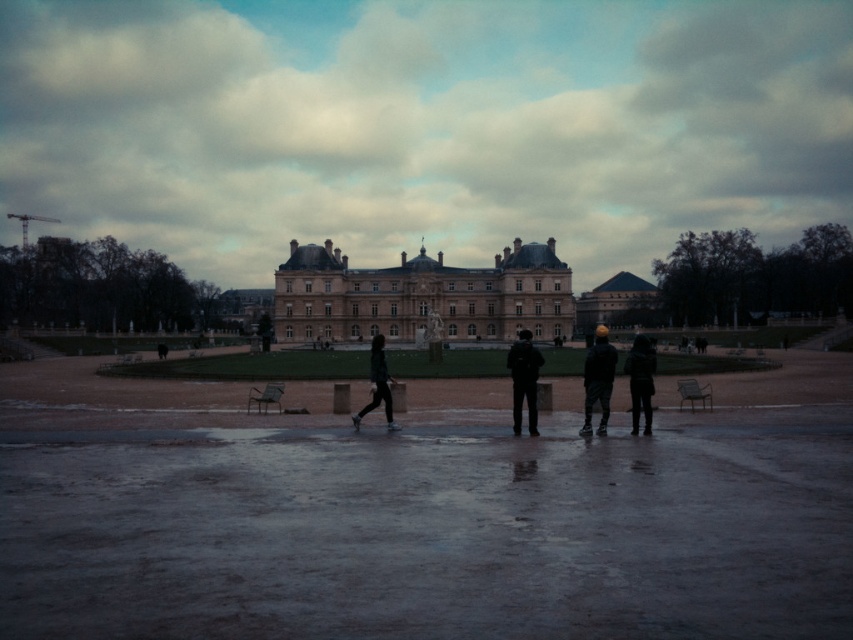
Locate an element on the screen. The height and width of the screenshot is (640, 853). beige stone palace at center is located at coordinates (422, 296).

Can you confirm if beige stone palace at center is smaller than dark blue jacket at center?

No, beige stone palace at center is not smaller than dark blue jacket at center.

Is point (325, 304) closer to camera compared to point (590, 412)?

That is False.

Where is `beige stone palace at center`? beige stone palace at center is located at coordinates (422, 296).

The height and width of the screenshot is (640, 853). What do you see at coordinates (422, 296) in the screenshot?
I see `beige stone palace at center` at bounding box center [422, 296].

Is point (402, 259) positioned in front of point (527, 416)?

That is False.

At what (x,y) coordinates should I click in order to perform the action: click on beige stone palace at center. Please return your answer as a coordinate pair (x, y). The width and height of the screenshot is (853, 640). Looking at the image, I should click on (422, 296).

Between dark blue fabric jacket at center and dark gray fabric jacket at center, which one is positioned lower?

dark blue fabric jacket at center is lower down.

Does dark blue fabric jacket at center lie behind dark gray fabric jacket at center?

No, dark blue fabric jacket at center is closer to the viewer.

From the picture: Measure the distance between point (x=538, y=365) and camera.

Point (x=538, y=365) is 357.53 feet away from camera.

Where is `dark blue fabric jacket at center`? dark blue fabric jacket at center is located at coordinates (524, 380).